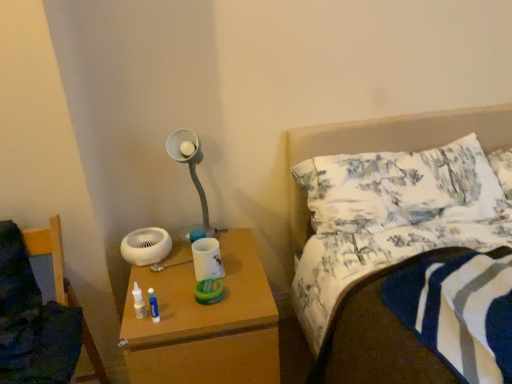
Question: Is white printed fabric pillow at upper right outside of wooden chair at lower left?

Choices:
 (A) yes
 (B) no

Answer: (A)

Question: Does white printed fabric pillow at upper right appear on the right side of wooden chair at lower left?

Choices:
 (A) yes
 (B) no

Answer: (A)

Question: From the image's perspective, is white printed fabric pillow at upper right located beneath wooden chair at lower left?

Choices:
 (A) yes
 (B) no

Answer: (B)

Question: Considering the relative sizes of white printed fabric pillow at upper right and wooden chair at lower left in the image provided, is white printed fabric pillow at upper right shorter than wooden chair at lower left?

Choices:
 (A) yes
 (B) no

Answer: (A)

Question: Is white printed fabric pillow at upper right positioned with its back to wooden chair at lower left?

Choices:
 (A) yes
 (B) no

Answer: (B)

Question: Considering the positions of wooden chair at lower left and white printed fabric pillow at upper right in the image, is wooden chair at lower left wider or thinner than white printed fabric pillow at upper right?

Choices:
 (A) wide
 (B) thin

Answer: (A)

Question: From the image's perspective, relative to white printed fabric pillow at upper right, is wooden chair at lower left above or below?

Choices:
 (A) below
 (B) above

Answer: (A)

Question: Does point (27, 355) appear closer or farther from the camera than point (357, 198)?

Choices:
 (A) farther
 (B) closer

Answer: (B)

Question: Do you think wooden chair at lower left is within white printed fabric pillow at upper right, or outside of it?

Choices:
 (A) outside
 (B) inside

Answer: (A)

Question: From the image's perspective, is wooden nightstand at lower center located above or below white matte lamp at upper center?

Choices:
 (A) above
 (B) below

Answer: (B)

Question: In terms of size, does wooden nightstand at lower center appear bigger or smaller than white matte lamp at upper center?

Choices:
 (A) small
 (B) big

Answer: (B)

Question: From their relative heights in the image, would you say wooden nightstand at lower center is taller or shorter than white matte lamp at upper center?

Choices:
 (A) tall
 (B) short

Answer: (A)

Question: From a real-world perspective, is wooden nightstand at lower center physically located above or below white matte lamp at upper center?

Choices:
 (A) above
 (B) below

Answer: (B)

Question: Which is correct: wooden nightstand at lower center is inside wooden chair at lower left, or outside of it?

Choices:
 (A) inside
 (B) outside

Answer: (B)

Question: Is wooden nightstand at lower center bigger or smaller than wooden chair at lower left?

Choices:
 (A) small
 (B) big

Answer: (B)